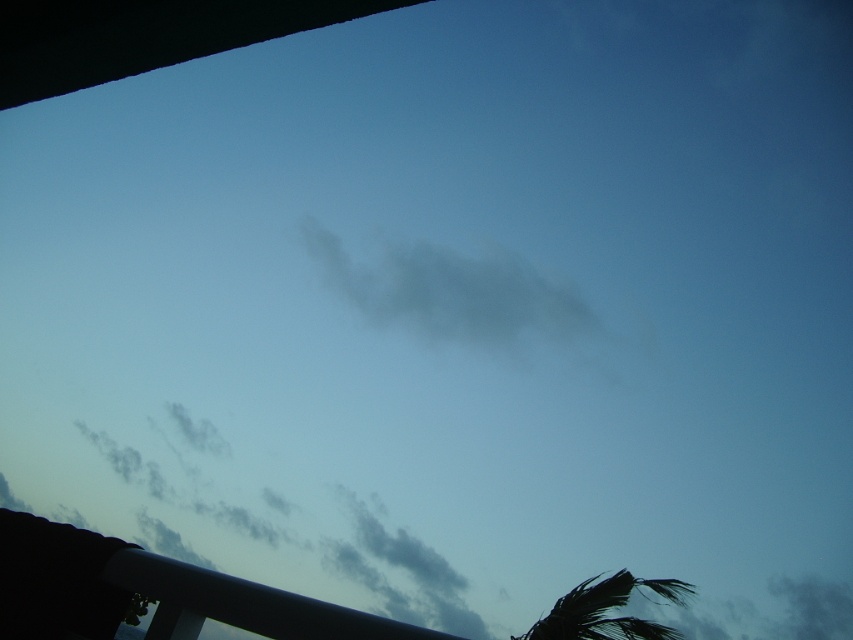
Does gray/cloudy cloud at center appear over green leafy palm tree at lower right?

Yes, gray/cloudy cloud at center is above green leafy palm tree at lower right.

Find the location of a particular element. The image size is (853, 640). gray/cloudy cloud at center is located at coordinates (463, 298).

Describe the element at coordinates (463, 298) in the screenshot. I see `gray/cloudy cloud at center` at that location.

You are a GUI agent. You are given a task and a screenshot of the screen. Output one action in this format:
    pyautogui.click(x=<x>, y=<y>)
    Task: Click on the gray/cloudy cloud at center
    The width and height of the screenshot is (853, 640).
    Given the screenshot: What is the action you would take?
    pyautogui.click(x=463, y=298)